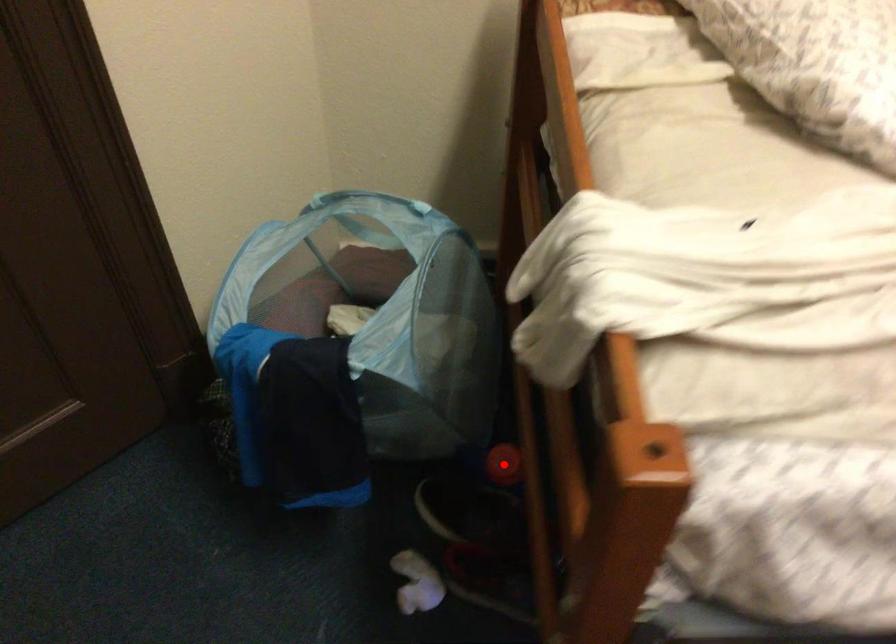
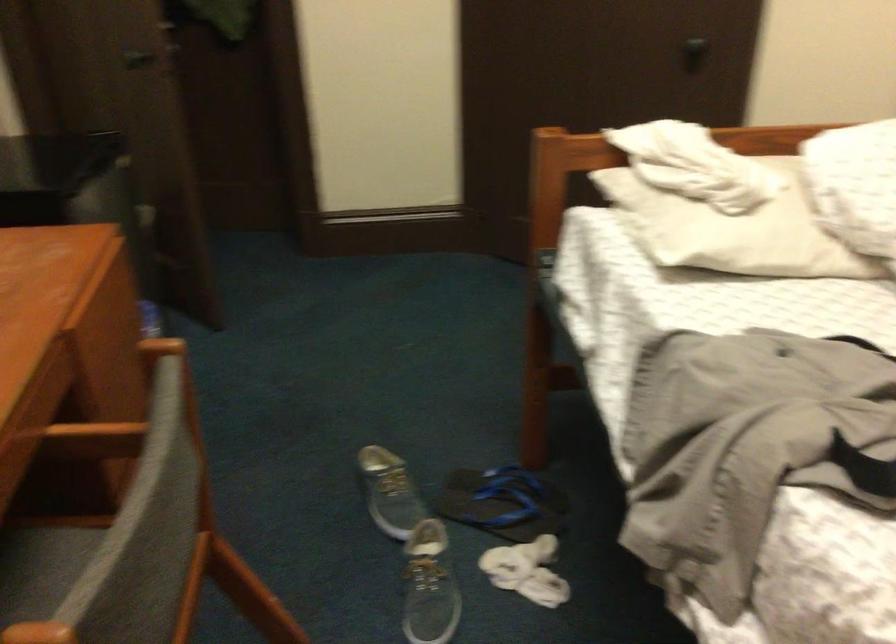
Question: I am providing you with two images of the same scene from different viewpoints. A red point is marked on the first image. Is the red point's position out of view in image 2?

Choices:
 (A) Yes
 (B) No

Answer: (A)